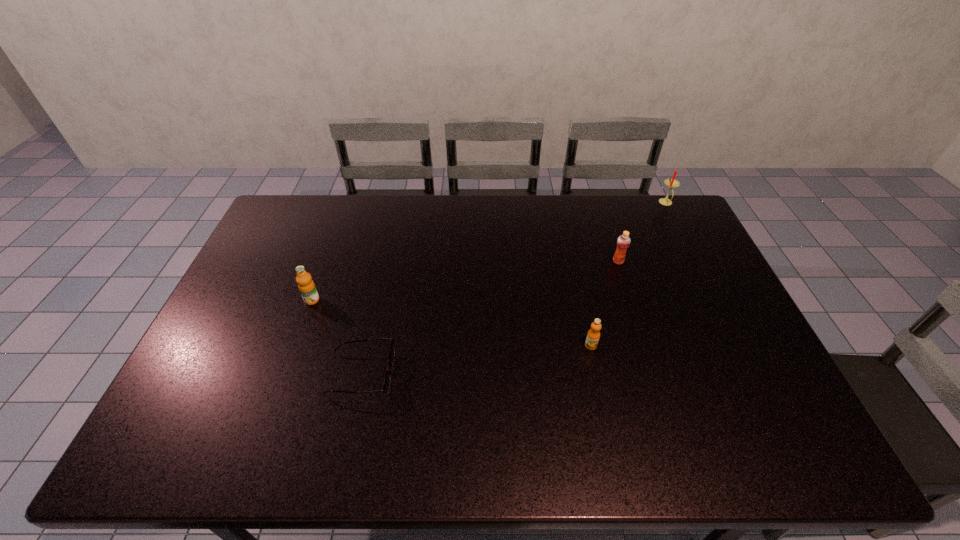
Find the location of `free space at the left edge of the desktop`. free space at the left edge of the desktop is located at coordinates (265, 303).

Identify the location of vacant space at the right edge. The width and height of the screenshot is (960, 540). (683, 238).

Find the location of a particular element. The width and height of the screenshot is (960, 540). vacant space that's between the third object from left to right and the farthest object is located at coordinates (629, 274).

In order to click on vacant area that lies between the nearest orange juice and the leftmost orange juice in this screenshot , I will do `click(451, 323)`.

You are a GUI agent. You are given a task and a screenshot of the screen. Output one action in this format:
    pyautogui.click(x=<x>, y=<y>)
    Task: Click on the unoccupied position between the leftmost orange juice and the nearest orange juice
    This screenshot has height=540, width=960.
    Given the screenshot: What is the action you would take?
    pyautogui.click(x=451, y=323)

Locate an element on the screen. The height and width of the screenshot is (540, 960). vacant region between the second object from right to left and the farthest object is located at coordinates (642, 232).

You are a GUI agent. You are given a task and a screenshot of the screen. Output one action in this format:
    pyautogui.click(x=<x>, y=<y>)
    Task: Click on the vacant area that lies between the farthest orange juice and the shortest object
    The image size is (960, 540).
    Given the screenshot: What is the action you would take?
    pyautogui.click(x=490, y=318)

Where is `empty location between the second farthest object and the second nearest orange juice`? empty location between the second farthest object and the second nearest orange juice is located at coordinates (465, 281).

This screenshot has height=540, width=960. In order to click on vacant area that lies between the farthest object and the second nearest orange juice in this screenshot , I will do `click(489, 252)`.

Locate an element on the screen. Image resolution: width=960 pixels, height=540 pixels. free area in between the farthest object and the second farthest object is located at coordinates (642, 232).